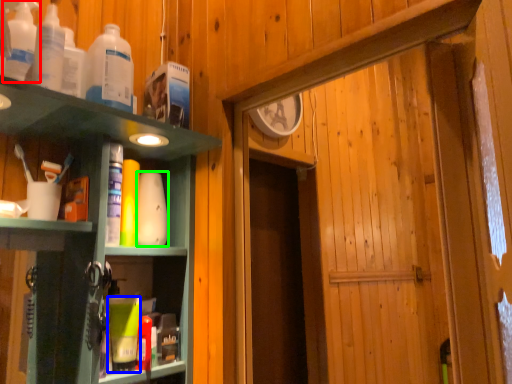
Question: Considering the real-world distances, which object is farthest from bottle (highlighted by a red box)? toiletry (highlighted by a blue box) or toiletry (highlighted by a green box)?

Choices:
 (A) toiletry
 (B) toiletry

Answer: (A)